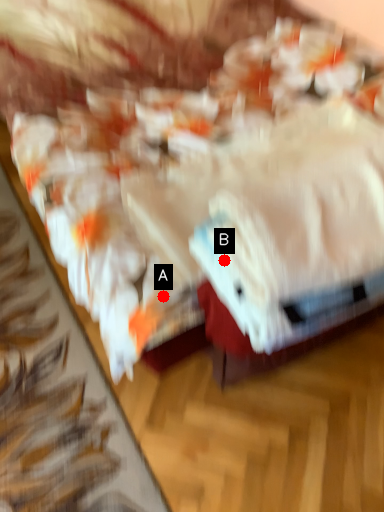
Question: Two points are circled on the image, labeled by A and B beside each circle. Which of the following is the closest to the observer?

Choices:
 (A) A is closer
 (B) B is closer

Answer: (B)